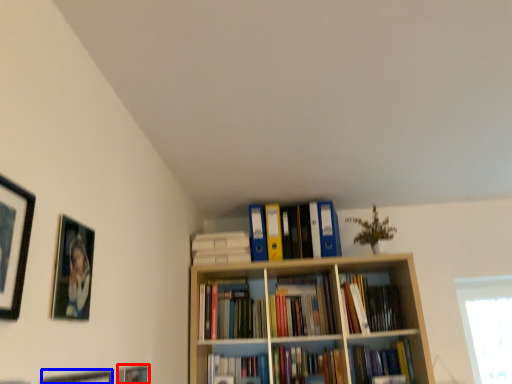
Question: Which of the following is the farthest to the observer, picture frame (highlighted by a red box) or picture frame (highlighted by a blue box)?

Choices:
 (A) picture frame
 (B) picture frame

Answer: (A)